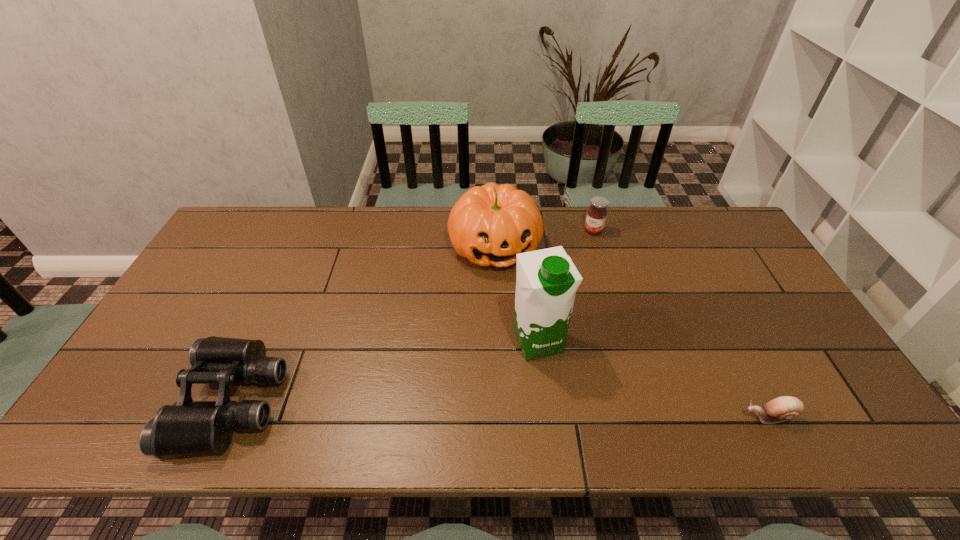
Locate an element on the screen. free space on the desktop that is between the leftmost object and the rightmost object and is positioned on the carved face of the pumpkin is located at coordinates (552, 410).

This screenshot has height=540, width=960. In order to click on free space on the desktop that is between the leftmost object and the shortest object and is positioned on the front-facing side of the soya milk in this screenshot , I will do `click(570, 411)`.

Identify the location of vacant spot on the desktop that is between the binoculars and the escargot and is positioned on the label side of the fourth object from left to right. (477, 408).